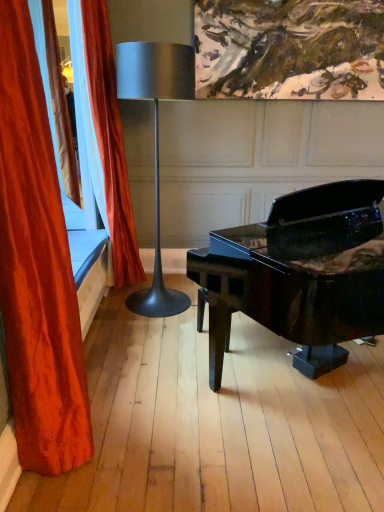
Question: From the image's perspective, is glossy black piano at center located above or below velvet orange curtain at left, positioned as the 1th curtain in back-to-front order?

Choices:
 (A) below
 (B) above

Answer: (A)

Question: From their relative heights in the image, would you say glossy black piano at center is taller or shorter than velvet orange curtain at left, positioned as the 1th curtain in back-to-front order?

Choices:
 (A) short
 (B) tall

Answer: (A)

Question: Which object is the farthest from the glossy black piano at center?

Choices:
 (A) metallic silver lamp at center
 (B) velvet red curtain at left, the 1th curtain positioned from the front
 (C) velvet orange curtain at left, positioned as the 1th curtain in back-to-front order

Answer: (B)

Question: Which is farther from the velvet orange curtain at left, marked as the 2th curtain in a front-to-back arrangement?

Choices:
 (A) metallic silver lamp at center
 (B) glossy black piano at center
 (C) velvet red curtain at left, the 2th curtain viewed from the back

Answer: (C)